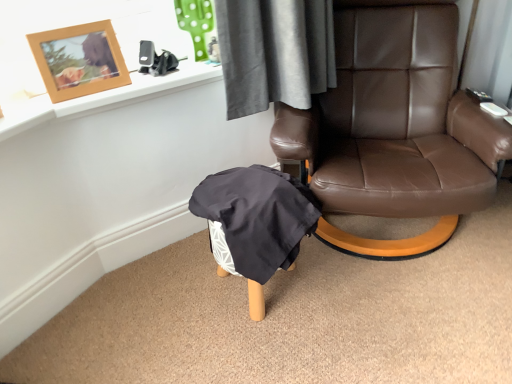
Question: Considering the relative positions of dark gray fabric bean bag chair at lower center and black plastic remote control at upper right, arranged as the second remote control when viewed from the top, in the image provided, is dark gray fabric bean bag chair at lower center to the right of black plastic remote control at upper right, arranged as the second remote control when viewed from the top, from the viewer's perspective?

Choices:
 (A) no
 (B) yes

Answer: (A)

Question: From a real-world perspective, is dark gray fabric bean bag chair at lower center physically below black plastic remote control at upper right, the 1th remote control from the front?

Choices:
 (A) yes
 (B) no

Answer: (A)

Question: From the image's perspective, is dark gray fabric bean bag chair at lower center above black plastic remote control at upper right, arranged as the second remote control when viewed from the top?

Choices:
 (A) no
 (B) yes

Answer: (A)

Question: Does dark gray fabric bean bag chair at lower center have a lesser width compared to black plastic remote control at upper right, arranged as the second remote control when viewed from the top?

Choices:
 (A) yes
 (B) no

Answer: (B)

Question: Is dark gray fabric bean bag chair at lower center positioned with its back to black plastic remote control at upper right, the 1th remote control from the front?

Choices:
 (A) no
 (B) yes

Answer: (A)

Question: From the image's perspective, is black plastic remote control at upper right, the 1th remote control from the bottom, above or below woodenobject at upper left?

Choices:
 (A) above
 (B) below

Answer: (B)

Question: Considering the positions of point (496, 114) and point (84, 77), is point (496, 114) closer or farther from the camera than point (84, 77)?

Choices:
 (A) farther
 (B) closer

Answer: (A)

Question: Considering their positions, is black plastic remote control at upper right, the 1th remote control from the bottom, located in front of or behind woodenobject at upper left?

Choices:
 (A) behind
 (B) front

Answer: (A)

Question: Which is correct: black plastic remote control at upper right, the 1th remote control from the bottom, is inside woodenobject at upper left, or outside of it?

Choices:
 (A) inside
 (B) outside

Answer: (B)

Question: In terms of size, does brown leather chair at center appear bigger or smaller than black plastic remote control at upper right, acting as the 2th remote control starting from the back?

Choices:
 (A) small
 (B) big

Answer: (B)

Question: Considering their positions, is brown leather chair at center located in front of or behind black plastic remote control at upper right, acting as the 2th remote control starting from the back?

Choices:
 (A) behind
 (B) front

Answer: (B)

Question: Based on their positions, is brown leather chair at center located to the left or right of black plastic remote control at upper right, arranged as the second remote control when viewed from the top?

Choices:
 (A) left
 (B) right

Answer: (A)

Question: Looking at their shapes, would you say brown leather chair at center is wider or thinner than black plastic remote control at upper right, arranged as the second remote control when viewed from the top?

Choices:
 (A) wide
 (B) thin

Answer: (A)

Question: Considering the positions of black plastic remote control at upper right, acting as the 2th remote control starting from the bottom, and brown leather chair at center in the image, is black plastic remote control at upper right, acting as the 2th remote control starting from the bottom, taller or shorter than brown leather chair at center?

Choices:
 (A) tall
 (B) short

Answer: (B)

Question: From a real-world perspective, is black plastic remote control at upper right, acting as the 2th remote control starting from the bottom, physically located above or below brown leather chair at center?

Choices:
 (A) above
 (B) below

Answer: (A)